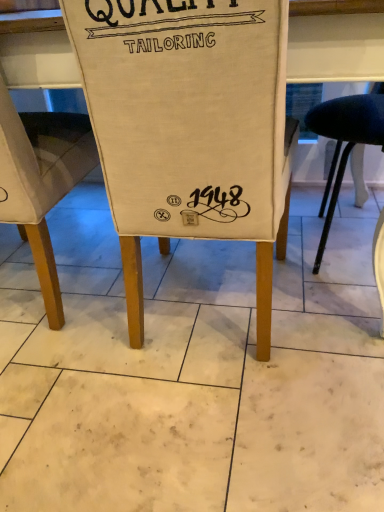
Image resolution: width=384 pixels, height=512 pixels. I want to click on vacant space in front of canvas chair at lower left, acting as the 1th chair starting from the left, so click(x=79, y=407).